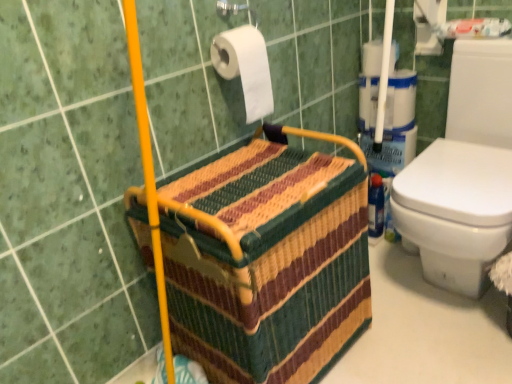
Question: In which direction should I rotate to look at white paper at upper center, the first toilet paper positioned from the top?

Choices:
 (A) left
 (B) right

Answer: (B)

Question: Does white matte toilet paper at upper center, positioned as the second toilet paper in top-to-bottom order, lie behind white paper at upper center, which is the 2th toilet paper from front to back?

Choices:
 (A) yes
 (B) no

Answer: (B)

Question: Considering the relative sizes of white matte toilet paper at upper center, acting as the second toilet paper starting from the right, and white paper at upper center, the 2th toilet paper in the left-to-right sequence, in the image provided, is white matte toilet paper at upper center, acting as the second toilet paper starting from the right, wider than white paper at upper center, the 2th toilet paper in the left-to-right sequence,?

Choices:
 (A) no
 (B) yes

Answer: (A)

Question: Does white matte toilet paper at upper center, positioned as the second toilet paper in top-to-bottom order, appear on the left side of white paper at upper center, which ranks as the 2th toilet paper in bottom-to-top order?

Choices:
 (A) no
 (B) yes

Answer: (B)

Question: Is white matte toilet paper at upper center, which is the 1th toilet paper in front-to-back order, facing away from white paper at upper center, the 2th toilet paper in the left-to-right sequence?

Choices:
 (A) no
 (B) yes

Answer: (A)

Question: Is white matte toilet paper at upper center, which is the 1th toilet paper from bottom to top, shorter than white paper at upper center, which ranks as the 2th toilet paper in bottom-to-top order?

Choices:
 (A) no
 (B) yes

Answer: (A)

Question: From a real-world perspective, is white matte toilet paper at upper center, which is the 2th toilet paper from back to front, beneath white paper at upper center, which is the 2th toilet paper from front to back?

Choices:
 (A) no
 (B) yes

Answer: (A)

Question: From the image's perspective, is white matte toilet paper at upper center, acting as the second toilet paper starting from the right, over multicolored woven basket at center?

Choices:
 (A) yes
 (B) no

Answer: (A)

Question: Considering the relative sizes of white matte toilet paper at upper center, positioned as the second toilet paper in top-to-bottom order, and multicolored woven basket at center in the image provided, is white matte toilet paper at upper center, positioned as the second toilet paper in top-to-bottom order, thinner than multicolored woven basket at center?

Choices:
 (A) yes
 (B) no

Answer: (A)

Question: Is white matte toilet paper at upper center, which is the 2th toilet paper from back to front, positioned behind multicolored woven basket at center?

Choices:
 (A) yes
 (B) no

Answer: (A)

Question: From a real-world perspective, does white matte toilet paper at upper center, positioned as the second toilet paper in top-to-bottom order, sit lower than multicolored woven basket at center?

Choices:
 (A) no
 (B) yes

Answer: (A)

Question: From a real-world perspective, is white matte toilet paper at upper center, which is the 1th toilet paper from bottom to top, on multicolored woven basket at center?

Choices:
 (A) yes
 (B) no

Answer: (A)

Question: Is white matte toilet paper at upper center, which is the 1th toilet paper in left-to-right order, facing towards multicolored woven basket at center?

Choices:
 (A) no
 (B) yes

Answer: (A)

Question: Is white paper at upper center, the 2th toilet paper in the left-to-right sequence, shorter than multicolored woven basket at center?

Choices:
 (A) yes
 (B) no

Answer: (A)